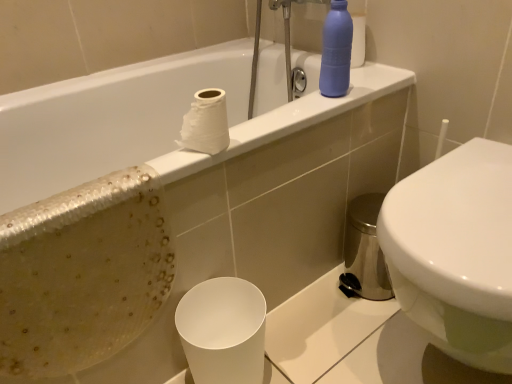
Question: Does white matte toilet paper at upper center have a greater height compared to matte blue bottle at upper right?

Choices:
 (A) no
 (B) yes

Answer: (A)

Question: Can you see white matte toilet paper at upper center touching matte blue bottle at upper right?

Choices:
 (A) no
 (B) yes

Answer: (A)

Question: Can you confirm if white matte toilet paper at upper center is shorter than matte blue bottle at upper right?

Choices:
 (A) no
 (B) yes

Answer: (B)

Question: From a real-world perspective, is white matte toilet paper at upper center over matte blue bottle at upper right?

Choices:
 (A) no
 (B) yes

Answer: (A)

Question: Does white matte toilet paper at upper center have a greater width compared to matte blue bottle at upper right?

Choices:
 (A) yes
 (B) no

Answer: (A)

Question: Is point (410, 309) closer or farther from the camera than point (215, 51)?

Choices:
 (A) closer
 (B) farther

Answer: (A)

Question: Is white glossy toilet at right situated inside white glossy bathtub at upper center or outside?

Choices:
 (A) outside
 (B) inside

Answer: (A)

Question: Relative to white glossy bathtub at upper center, is white glossy toilet at right in front or behind?

Choices:
 (A) front
 (B) behind

Answer: (A)

Question: Is white glossy toilet at right bigger or smaller than white glossy bathtub at upper center?

Choices:
 (A) small
 (B) big

Answer: (A)

Question: Do you think matte blue bottle at upper right is within white matte paper cup at lower center, or outside of it?

Choices:
 (A) outside
 (B) inside

Answer: (A)

Question: From their relative heights in the image, would you say matte blue bottle at upper right is taller or shorter than white matte paper cup at lower center?

Choices:
 (A) short
 (B) tall

Answer: (A)

Question: Considering the positions of matte blue bottle at upper right and white matte paper cup at lower center in the image, is matte blue bottle at upper right wider or thinner than white matte paper cup at lower center?

Choices:
 (A) wide
 (B) thin

Answer: (B)

Question: Does point (333, 96) appear closer or farther from the camera than point (260, 316)?

Choices:
 (A) farther
 (B) closer

Answer: (A)

Question: In the image, is white matte toilet paper at upper center positioned in front of or behind white glossy toilet at right?

Choices:
 (A) front
 (B) behind

Answer: (B)

Question: Is white matte toilet paper at upper center bigger or smaller than white glossy toilet at right?

Choices:
 (A) big
 (B) small

Answer: (B)